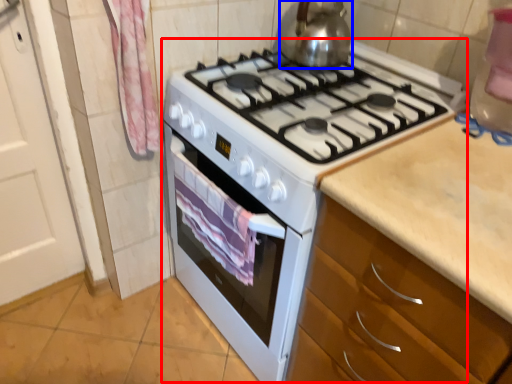
Question: Which object is closer to the camera taking this photo, appliance (highlighted by a red box) or kitchen appliance (highlighted by a blue box)?

Choices:
 (A) appliance
 (B) kitchen appliance

Answer: (A)